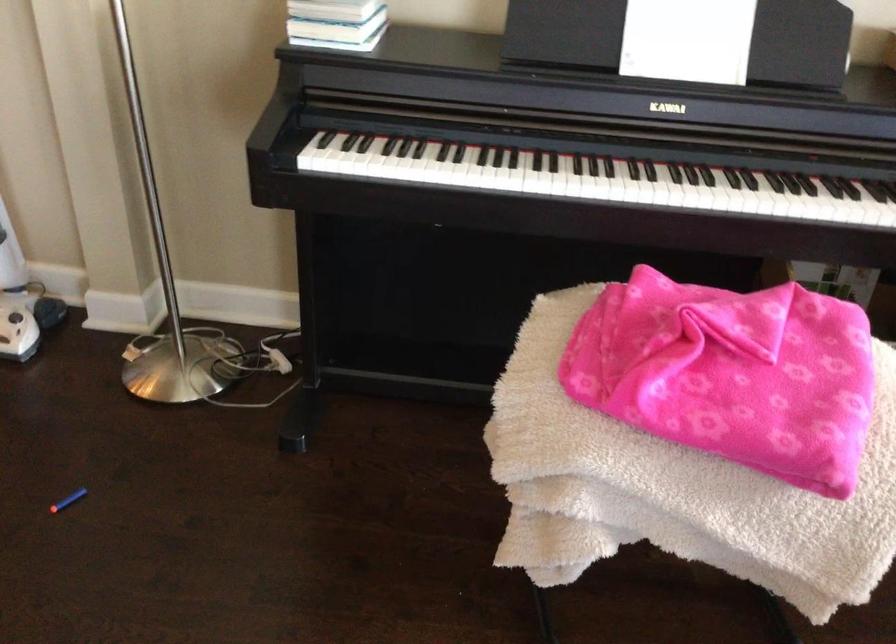
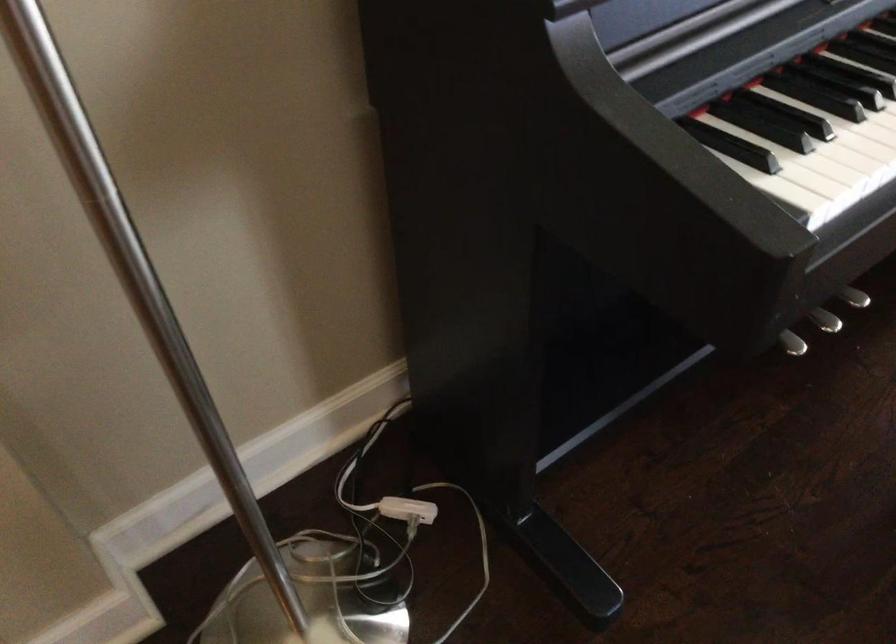
In the second image, find the point that corresponds to the point at 336,167 in the first image.

(851, 196)